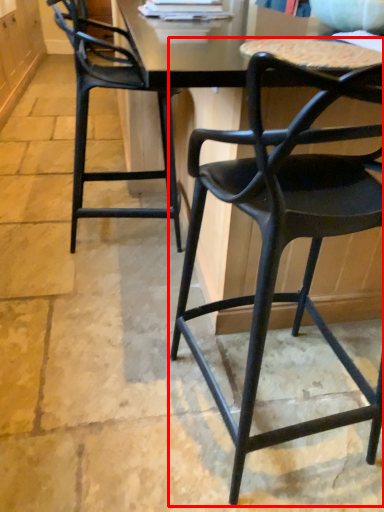
Question: From the image's perspective, where is chair (annotated by the red box) located in relation to chair in the image?

Choices:
 (A) above
 (B) below

Answer: (B)